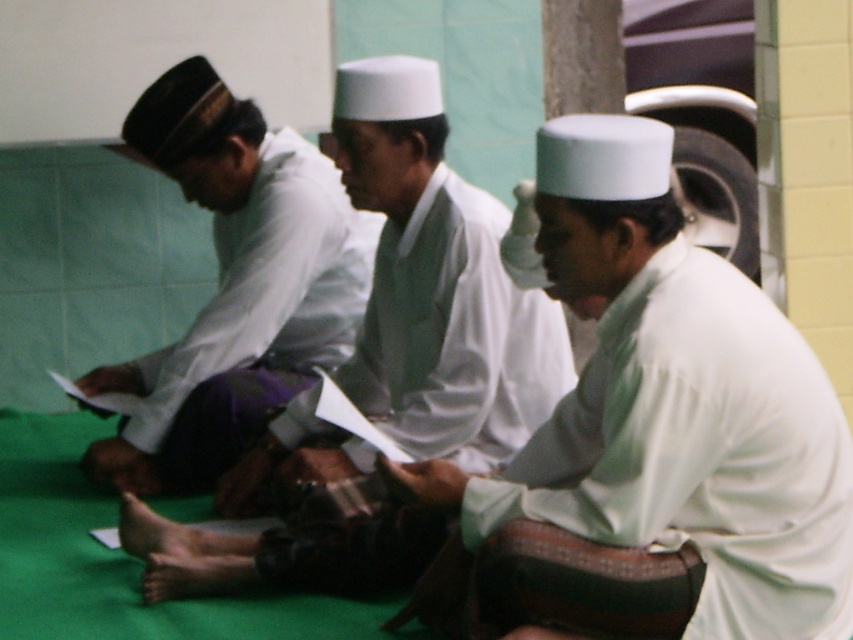
Does white matte hat at center appear over matte white shirt at center?

Incorrect, white matte hat at center is not positioned above matte white shirt at center.

Is white matte hat at center to the right of matte white shirt at center from the viewer's perspective?

Correct, you'll find white matte hat at center to the right of matte white shirt at center.

Which is behind, point (384, 93) or point (206, 308)?

Point (206, 308)

Identify the location of white matte hat at center. This screenshot has height=640, width=853. (438, 282).

Measure the distance between light green fabric at center and matte white shirt at center.

A distance of 4.74 feet exists between light green fabric at center and matte white shirt at center.

Does light green fabric at center appear under matte white shirt at center?

Correct, light green fabric at center is located below matte white shirt at center.

Based on the photo, who is more distant from viewer, (611,125) or (271,192)?

The point (271,192) is behind.

The width and height of the screenshot is (853, 640). Identify the location of light green fabric at center. (672, 404).

Measure the distance between point (x=653, y=515) and camera.

2.64 meters

What do you see at coordinates (672, 404) in the screenshot?
I see `light green fabric at center` at bounding box center [672, 404].

Identify the location of light green fabric at center. (672, 404).